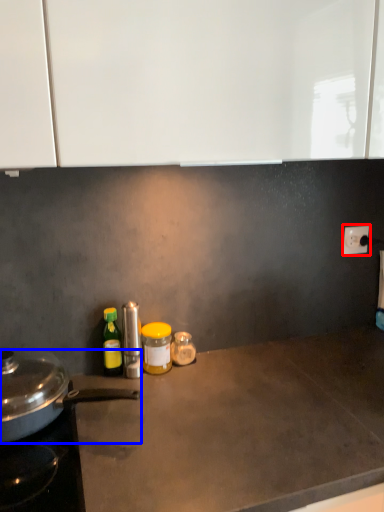
Question: Which point is further to the camera, electric outlet (highlighted by a red box) or kitchen appliance (highlighted by a blue box)?

Choices:
 (A) electric outlet
 (B) kitchen appliance

Answer: (A)